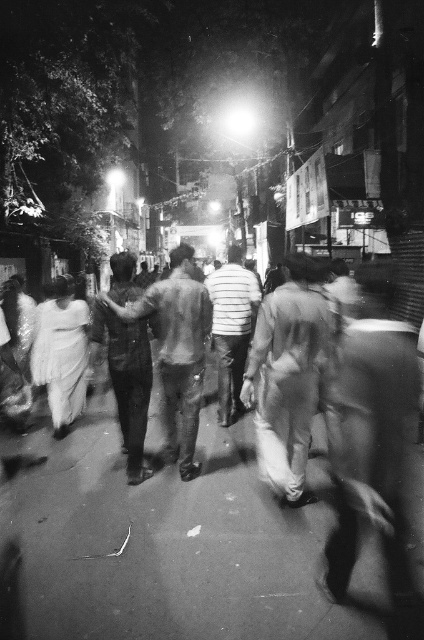
Which is behind, point (41, 548) or point (332, 592)?

Point (41, 548)

Can you confirm if smooth fabric crowd at center is wider than smooth fabric shirt at right?

Correct, the width of smooth fabric crowd at center exceeds that of smooth fabric shirt at right.

Is point (116, 579) farther from viewer compared to point (343, 445)?

No, (116, 579) is closer to viewer.

This screenshot has height=640, width=424. What are the coordinates of `smooth fabric crowd at center` in the screenshot? It's located at (180, 540).

Does point (86, 568) come farther from viewer compared to point (187, 476)?

No, it is in front of (187, 476).

What do you see at coordinates (180, 540) in the screenshot? I see `smooth fabric crowd at center` at bounding box center [180, 540].

Is point (75, 561) positioned before point (211, 307)?

Yes, it is.

At what (x,y) coordinates should I click in order to perform the action: click on smooth fabric crowd at center. Please return your answer as a coordinate pair (x, y). This screenshot has width=424, height=640. Looking at the image, I should click on (180, 540).

Which is more to the left, smooth fabric shirt at right or smooth fabric shirt at center?

smooth fabric shirt at center is more to the left.

Between point (384, 512) and point (203, 336), which one is positioned behind?

The point (203, 336) is behind.

The image size is (424, 640). I want to click on smooth fabric shirt at right, so click(371, 432).